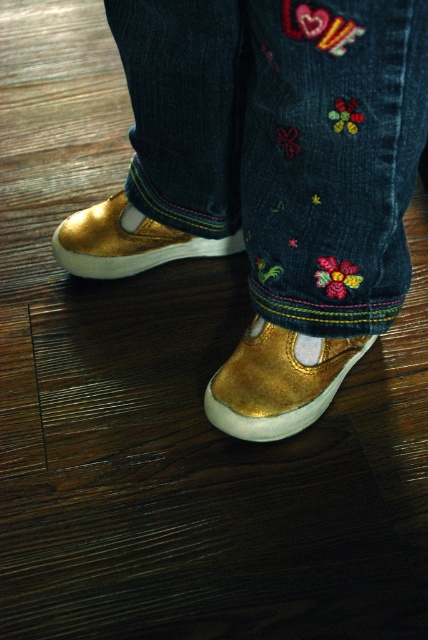
Question: Does denim jeans with embroidered patches at center appear over gold metallic shoe at left?

Choices:
 (A) yes
 (B) no

Answer: (A)

Question: Is denim jeans with embroidered patches at center in front of gold metallic shoe at left?

Choices:
 (A) yes
 (B) no

Answer: (A)

Question: Which of the following is the farthest from the observer?

Choices:
 (A) gold metallic shoe at left
 (B) gold suede shoe at lower center
 (C) denim jeans with embroidered patches at center

Answer: (A)

Question: Which point appears closest to the camera in this image?

Choices:
 (A) (210, 186)
 (B) (210, 387)
 (C) (109, 275)

Answer: (B)

Question: Is denim jeans with embroidered patches at center above gold suede shoe at lower center?

Choices:
 (A) no
 (B) yes

Answer: (B)

Question: Which point is closer to the camera taking this photo?

Choices:
 (A) coord(285,337)
 (B) coord(110,220)

Answer: (A)